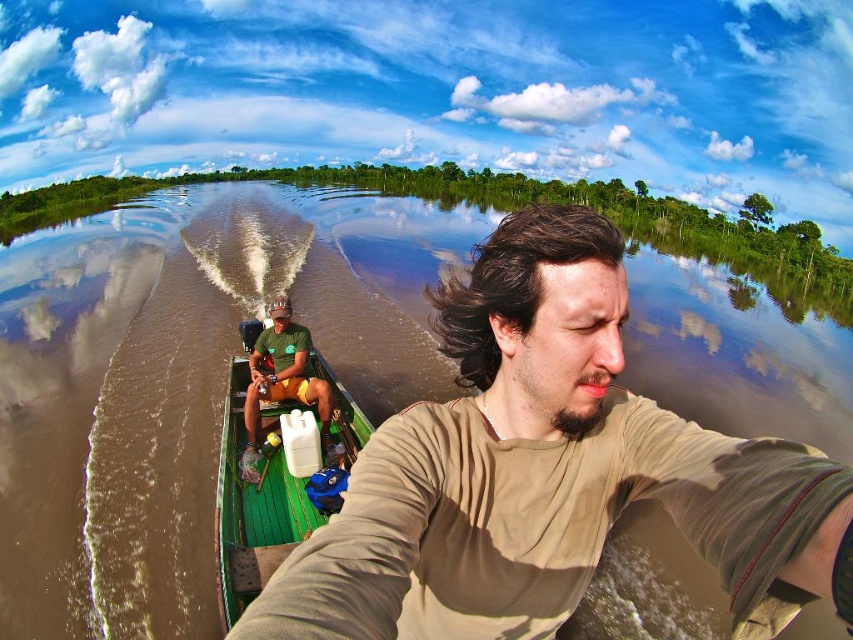
Question: Which is farther from the green wooden boat at center?

Choices:
 (A) brown matte shirt at center
 (B) green matte shirt at center

Answer: (A)

Question: Is brown matte shirt at center to the right of green matte shirt at center from the viewer's perspective?

Choices:
 (A) no
 (B) yes

Answer: (B)

Question: Which object is the farthest from the green wooden boat at center?

Choices:
 (A) brown matte shirt at center
 (B) green matte shirt at center

Answer: (A)

Question: Is green wooden boat at center to the right of green matte shirt at center from the viewer's perspective?

Choices:
 (A) no
 (B) yes

Answer: (A)

Question: Is brown matte shirt at center closer to the viewer compared to green matte shirt at center?

Choices:
 (A) no
 (B) yes

Answer: (B)

Question: Which of these objects is positioned farthest from the green matte shirt at center?

Choices:
 (A) green wooden boat at center
 (B) brown matte shirt at center

Answer: (B)